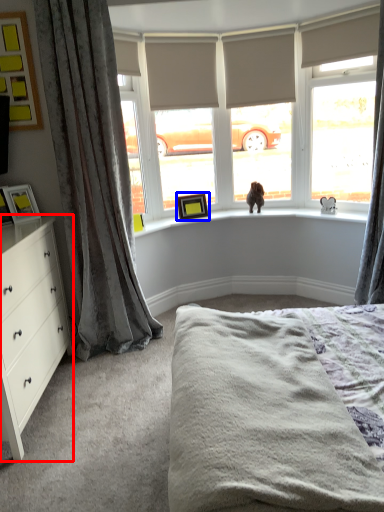
Question: Among these objects, which one is farthest to the camera, chest of drawers (highlighted by a red box) or picture frame (highlighted by a blue box)?

Choices:
 (A) chest of drawers
 (B) picture frame

Answer: (B)